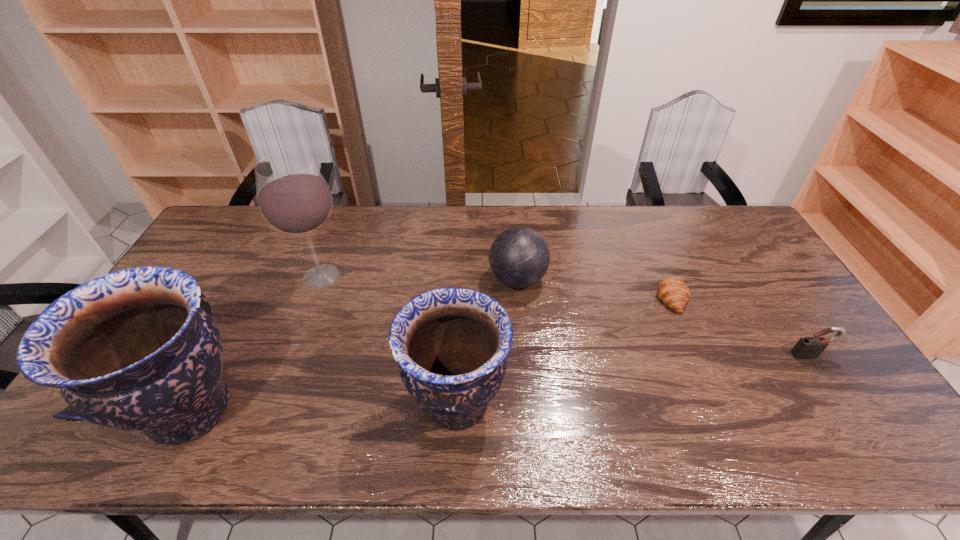
The image size is (960, 540). In order to click on free space located on the front handle of the fourth shortest object in this screenshot , I will do `click(548, 403)`.

Locate an element on the screen. Image resolution: width=960 pixels, height=540 pixels. vacant region located 0.220m on the front of the crescent roll is located at coordinates (708, 379).

Find the location of a particular element. The height and width of the screenshot is (540, 960). vacant space located on the grip area of the third shortest object is located at coordinates (425, 280).

This screenshot has height=540, width=960. I want to click on vacant region located on the grip area of the third shortest object, so click(472, 280).

The width and height of the screenshot is (960, 540). I want to click on free space located on the grip area of the third shortest object, so click(466, 280).

You are a GUI agent. You are given a task and a screenshot of the screen. Output one action in this format:
    pyautogui.click(x=<x>, y=<y>)
    Task: Click on the vacant space located 0.350m on the right of the tallest object
    This screenshot has width=960, height=540.
    Given the screenshot: What is the action you would take?
    pyautogui.click(x=462, y=277)

The height and width of the screenshot is (540, 960). In order to click on free spot located 0.150m with the keyhole on the front of the rightmost object in this screenshot , I will do `click(845, 410)`.

You are a GUI agent. You are given a task and a screenshot of the screen. Output one action in this format:
    pyautogui.click(x=<x>, y=<y>)
    Task: Click on the object that is at the left edge
    
    Given the screenshot: What is the action you would take?
    pyautogui.click(x=136, y=349)

At what (x,y) coordinates should I click in order to perform the action: click on object present at the right edge. Please return your answer as a coordinate pair (x, y). The image size is (960, 540). Looking at the image, I should click on (807, 347).

The height and width of the screenshot is (540, 960). I want to click on object that is positioned at the near left corner, so click(136, 349).